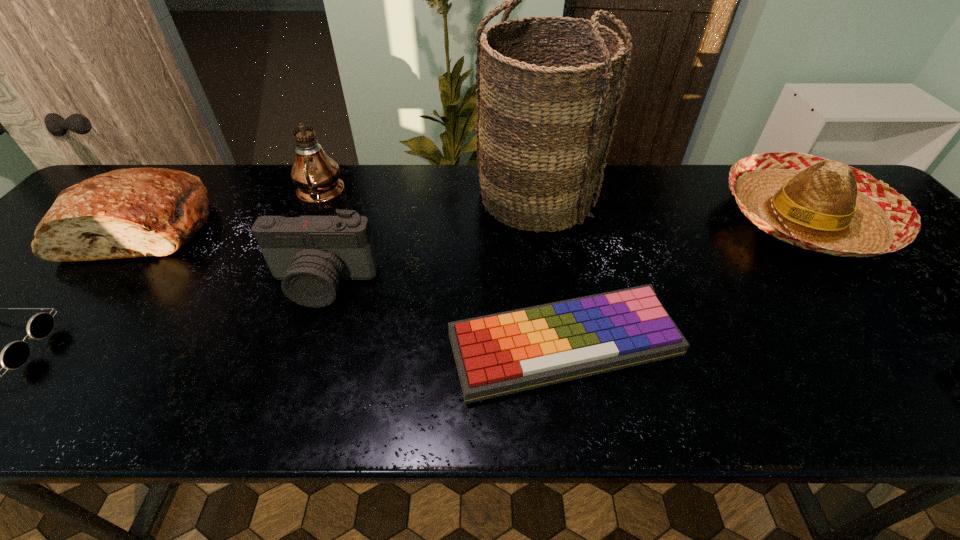
Image resolution: width=960 pixels, height=540 pixels. What are the coordinates of `basket` in the screenshot? It's located at tap(544, 128).

Locate an element on the screen. oil lamp is located at coordinates (316, 175).

Locate an element on the screen. sombrero is located at coordinates (818, 204).

The height and width of the screenshot is (540, 960). Find the location of `bread`. bread is located at coordinates (136, 212).

Where is `camera`? This screenshot has height=540, width=960. camera is located at coordinates (310, 254).

Where is `computer keyboard`? computer keyboard is located at coordinates (499, 354).

At what (x,y) coordinates should I click in order to perform the action: click on free space located 0.160m on the right of the tallest object. Please return your answer as a coordinate pair (x, y). Looking at the image, I should click on (652, 199).

At what (x,y) coordinates should I click in order to perform the action: click on vacant area situated on the right of the seventh shortest object. Please return your answer as a coordinate pair (x, y). The image size is (960, 540). Looking at the image, I should click on (381, 195).

Locate an element on the screen. free space located on the left of the sombrero is located at coordinates (647, 218).

Where is `free region located 0.100m at the sliced front of the bread`? free region located 0.100m at the sliced front of the bread is located at coordinates (87, 300).